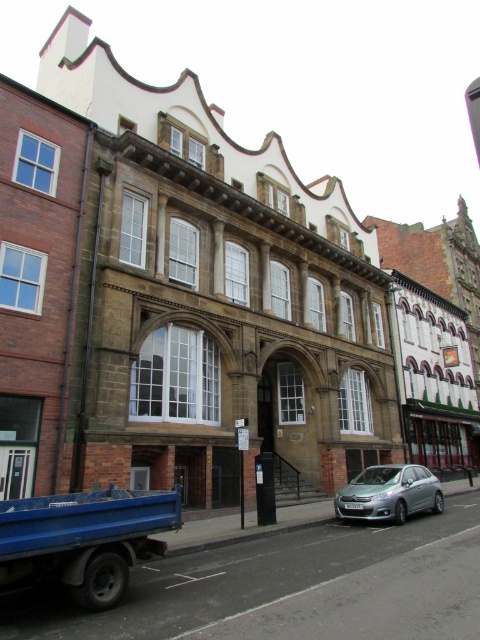
You are a pedestrian standing on the sidewalk across the street from the historic building. You want to cross the street to reach the entrance of the building. Which vehicle should you walk around first, the blue matte truck at lower left or the satin silver car at lower center?

The blue matte truck at lower left is in front of the satin silver car at lower center, so you should walk around the blue matte truck at lower left first because it is closer to you on the street.

From the picture: You are a pedestrian standing on the sidewalk and want to cross the street to reach the historic building. There is a blue matte truck at lower left and a satin silver car at lower center blocking your path. Which vehicle should you move around first to get to the building?

The blue matte truck at lower left is positioned over the satin silver car at lower center, so you should move around the blue matte truck at lower left first to reach the building.